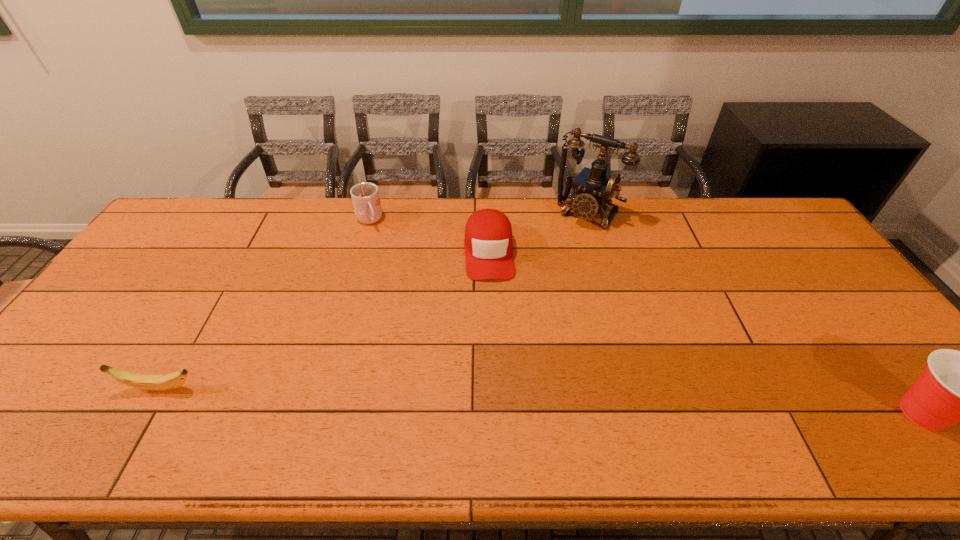
The height and width of the screenshot is (540, 960). What are the coordinates of `baseball cap at the far edge` in the screenshot? It's located at (488, 244).

The height and width of the screenshot is (540, 960). Identify the location of telephone present at the far edge. (594, 187).

This screenshot has width=960, height=540. What are the coordinates of `cup located at the far edge` in the screenshot? It's located at (365, 196).

This screenshot has width=960, height=540. I want to click on object that is at the near edge, so click(x=163, y=382).

Find the location of a particular element. free location at the far edge of the desktop is located at coordinates (227, 208).

Image resolution: width=960 pixels, height=540 pixels. Identify the location of vacant space at the left edge of the desktop. (125, 354).

The image size is (960, 540). Identify the location of blank area at the right edge. (864, 319).

Find the location of `free spot at the far right corner of the desktop`. free spot at the far right corner of the desktop is located at coordinates (748, 214).

You are a GUI agent. You are given a task and a screenshot of the screen. Output one action in this format:
    pyautogui.click(x=<x>, y=<y>)
    Task: Click on the blank region between the third object from left to right and the farther cup
    
    Given the screenshot: What is the action you would take?
    pyautogui.click(x=429, y=236)

At what (x,y) coordinates should I click in order to perform the action: click on empty location between the banana and the baseball cap. Please return your answer as a coordinate pair (x, y). The image size is (960, 540). Looking at the image, I should click on (324, 320).